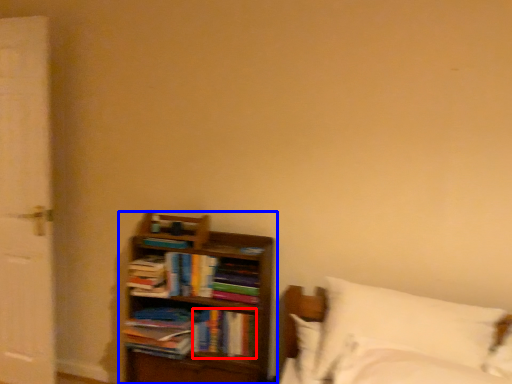
Question: Which of the following is the closest to the observer, book (highlighted by a red box) or bookcase (highlighted by a blue box)?

Choices:
 (A) book
 (B) bookcase

Answer: (B)